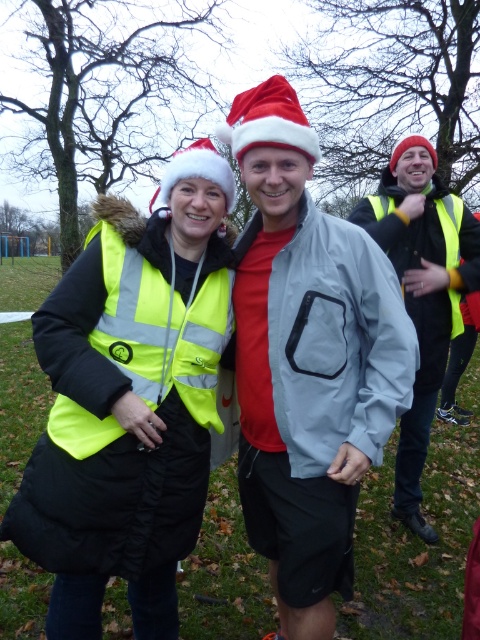
Question: Is neon yellow reflective safety vest at left positioned before red velvet santa hat at center?

Choices:
 (A) yes
 (B) no

Answer: (A)

Question: Can you confirm if neon yellow reflective vest at center is positioned below yellow high-visibility vest at right?

Choices:
 (A) no
 (B) yes

Answer: (B)

Question: Which of the following is the closest to the observer?

Choices:
 (A) pos(240,115)
 (B) pos(309,248)
 (C) pos(455,209)
 (D) pos(412,154)

Answer: (B)

Question: Estimate the real-world distances between objects in this image. Which object is farther from the matte gray jacket at center?

Choices:
 (A) red velvet santa hat at center
 (B) neon yellow reflective safety vest at left
 (C) matte yellow vest at center
 (D) neon yellow reflective vest at center

Answer: (C)

Question: Is matte gray jacket at center positioned behind neon yellow reflective safety vest at left?

Choices:
 (A) yes
 (B) no

Answer: (A)

Question: Which point is closer to the camera?

Choices:
 (A) neon yellow reflective vest at center
 (B) red velvet santa hat at center
 (C) yellow high-visibility vest at right
 (D) matte yellow vest at center

Answer: (A)